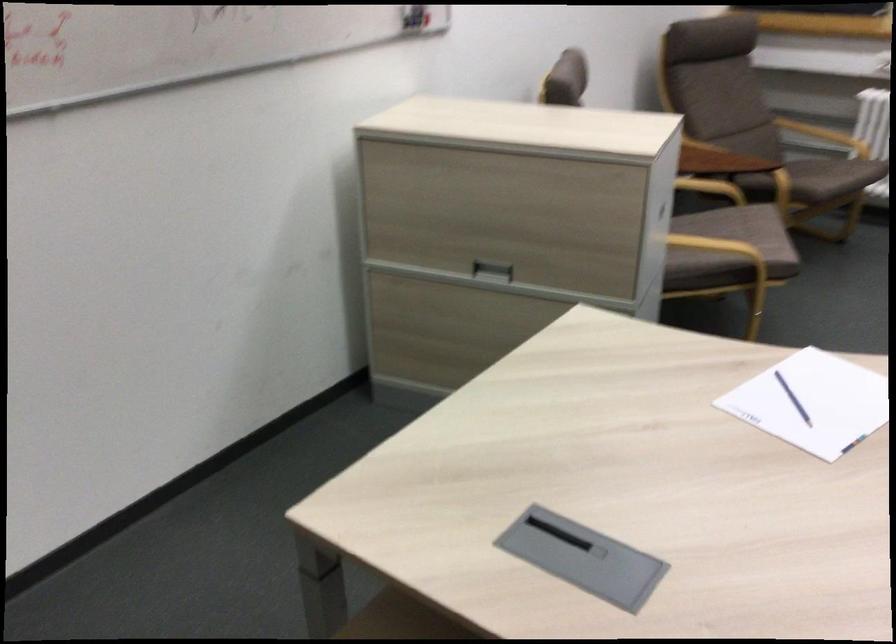
What do you see at coordinates (492, 270) in the screenshot?
I see `a cabinet drawer handle` at bounding box center [492, 270].